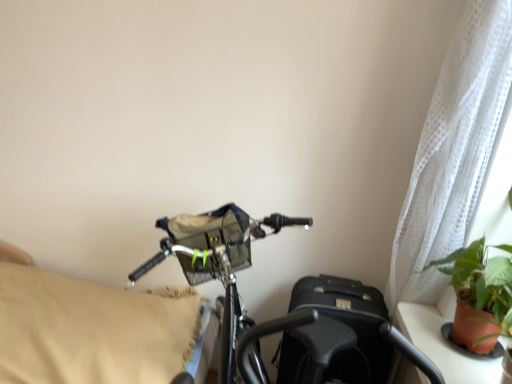
Question: Are white sheer curtain at upper right and beige fabric pillow at left making contact?

Choices:
 (A) no
 (B) yes

Answer: (A)

Question: Considering the relative sizes of white sheer curtain at upper right and beige fabric pillow at left in the image provided, is white sheer curtain at upper right shorter than beige fabric pillow at left?

Choices:
 (A) yes
 (B) no

Answer: (B)

Question: From a real-world perspective, is white sheer curtain at upper right beneath beige fabric pillow at left?

Choices:
 (A) yes
 (B) no

Answer: (B)

Question: Does white sheer curtain at upper right turn towards beige fabric pillow at left?

Choices:
 (A) no
 (B) yes

Answer: (B)

Question: Does white sheer curtain at upper right come in front of beige fabric pillow at left?

Choices:
 (A) yes
 (B) no

Answer: (A)

Question: Is beige fabric pillow at left in front of or behind green leafy plant in terracotta pot at right in the image?

Choices:
 (A) behind
 (B) front

Answer: (A)

Question: Is beige fabric pillow at left taller or shorter than green leafy plant in terracotta pot at right?

Choices:
 (A) short
 (B) tall

Answer: (B)

Question: Considering the positions of point (111, 337) and point (479, 266), is point (111, 337) closer or farther from the camera than point (479, 266)?

Choices:
 (A) farther
 (B) closer

Answer: (A)

Question: Looking at their shapes, would you say beige fabric pillow at left is wider or thinner than green leafy plant in terracotta pot at right?

Choices:
 (A) thin
 (B) wide

Answer: (B)

Question: Looking at the image, does white sheer curtain at upper right seem bigger or smaller compared to green leafy plant in terracotta pot at right?

Choices:
 (A) small
 (B) big

Answer: (B)

Question: From their relative heights in the image, would you say white sheer curtain at upper right is taller or shorter than green leafy plant in terracotta pot at right?

Choices:
 (A) tall
 (B) short

Answer: (A)

Question: Considering the positions of white sheer curtain at upper right and green leafy plant in terracotta pot at right in the image, is white sheer curtain at upper right wider or thinner than green leafy plant in terracotta pot at right?

Choices:
 (A) thin
 (B) wide

Answer: (A)

Question: Considering the positions of point (460, 120) and point (472, 347), is point (460, 120) closer or farther from the camera than point (472, 347)?

Choices:
 (A) farther
 (B) closer

Answer: (A)

Question: Relative to green leafy plant in terracotta pot at right, is shiny metallic bicycle at center in front or behind?

Choices:
 (A) front
 (B) behind

Answer: (A)

Question: Is shiny metallic bicycle at center wider or thinner than green leafy plant in terracotta pot at right?

Choices:
 (A) thin
 (B) wide

Answer: (B)